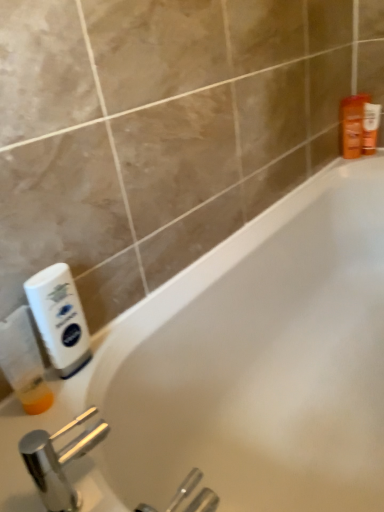
Question: Is white glossy bathtub at center smaller than translucent plastic bottle at left, positioned as the second cleaning product in right-to-left order?

Choices:
 (A) yes
 (B) no

Answer: (B)

Question: Does white glossy bathtub at center appear on the right side of translucent plastic bottle at left, acting as the 1th cleaning product starting from the left?

Choices:
 (A) yes
 (B) no

Answer: (A)

Question: Does white glossy bathtub at center have a lesser height compared to translucent plastic bottle at left, positioned as the second cleaning product in right-to-left order?

Choices:
 (A) yes
 (B) no

Answer: (B)

Question: Considering the relative positions of white glossy bathtub at center and translucent plastic bottle at left, acting as the 1th cleaning product starting from the left, in the image provided, is white glossy bathtub at center behind translucent plastic bottle at left, acting as the 1th cleaning product starting from the left,?

Choices:
 (A) yes
 (B) no

Answer: (B)

Question: Does white glossy bathtub at center contain translucent plastic bottle at left, positioned as the second cleaning product in right-to-left order?

Choices:
 (A) yes
 (B) no

Answer: (B)

Question: From the image's perspective, is white glossy bathtub at center positioned above or below polished chrome faucet at lower left?

Choices:
 (A) above
 (B) below

Answer: (A)

Question: Is white glossy bathtub at center spatially inside polished chrome faucet at lower left, or outside of it?

Choices:
 (A) outside
 (B) inside

Answer: (A)

Question: From a real-world perspective, is white glossy bathtub at center above or below polished chrome faucet at lower left?

Choices:
 (A) above
 (B) below

Answer: (B)

Question: Is white glossy bathtub at center bigger or smaller than polished chrome faucet at lower left?

Choices:
 (A) big
 (B) small

Answer: (A)

Question: Is translucent plastic bottle at left, acting as the 1th cleaning product starting from the left, bigger or smaller than white glossy bathtub at center?

Choices:
 (A) big
 (B) small

Answer: (B)

Question: Is translucent plastic bottle at left, acting as the 1th cleaning product starting from the left, taller or shorter than white glossy bathtub at center?

Choices:
 (A) tall
 (B) short

Answer: (B)

Question: Is translucent plastic bottle at left, positioned as the second cleaning product in right-to-left order, spatially inside white glossy bathtub at center, or outside of it?

Choices:
 (A) outside
 (B) inside

Answer: (A)

Question: Is point (43, 372) closer or farther from the camera than point (125, 364)?

Choices:
 (A) closer
 (B) farther

Answer: (A)

Question: Considering the relative positions of white plastic bottle at left, the 1th cleaning product in the right-to-left sequence, and translucent plastic bottle at left, acting as the 1th cleaning product starting from the left, in the image provided, is white plastic bottle at left, the 1th cleaning product in the right-to-left sequence, to the left or to the right of translucent plastic bottle at left, acting as the 1th cleaning product starting from the left,?

Choices:
 (A) left
 (B) right

Answer: (B)

Question: Looking at their shapes, would you say white plastic bottle at left, acting as the 2th cleaning product starting from the left, is wider or thinner than translucent plastic bottle at left, acting as the 1th cleaning product starting from the left?

Choices:
 (A) wide
 (B) thin

Answer: (B)